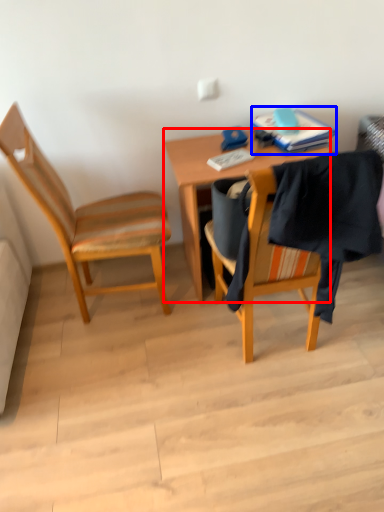
Question: Which object is further to the camera taking this photo, desk (highlighted by a red box) or book (highlighted by a blue box)?

Choices:
 (A) desk
 (B) book

Answer: (B)